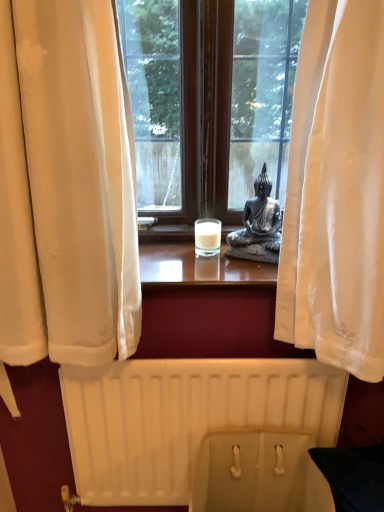
At what (x,y) coordinates should I click in order to perform the action: click on vacant area that is in front of satin black statue at center. Please return your answer as a coordinate pair (x, y). Image resolution: width=384 pixels, height=512 pixels. Looking at the image, I should click on (249, 271).